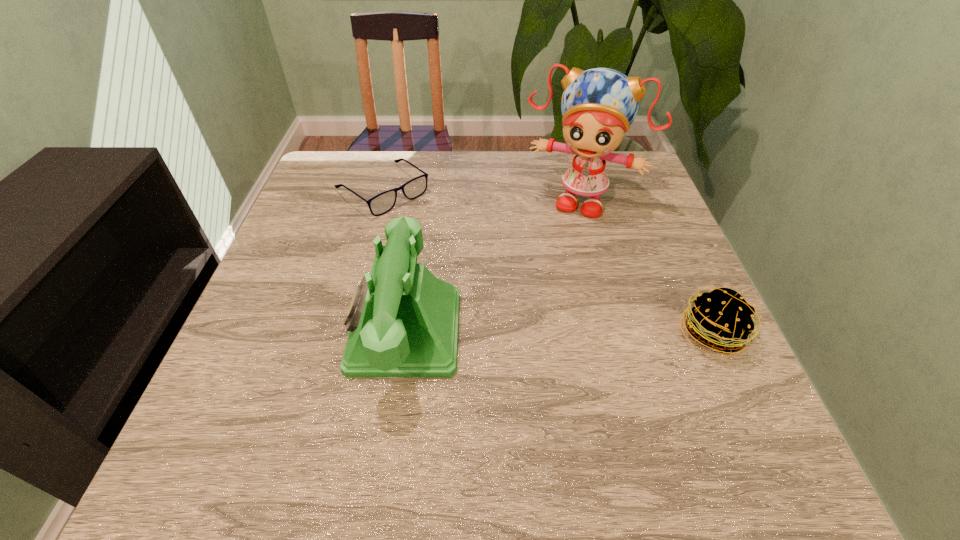
The width and height of the screenshot is (960, 540). I want to click on free space between the shortest object and the patty, so click(x=547, y=262).

Find the location of `vacant point located between the doll and the telephone`. vacant point located between the doll and the telephone is located at coordinates (492, 265).

At what (x,y) coordinates should I click in order to perform the action: click on vacant area between the second tallest object and the tallest object. Please return your answer as a coordinate pair (x, y). Looking at the image, I should click on (492, 265).

Find the location of a particular element. Image resolution: width=960 pixels, height=540 pixels. empty location between the second shortest object and the second tallest object is located at coordinates (558, 333).

You are a GUI agent. You are given a task and a screenshot of the screen. Output one action in this format:
    pyautogui.click(x=<x>, y=<y>)
    Task: Click on the free area in between the second tallest object and the doll
    The width and height of the screenshot is (960, 540).
    Given the screenshot: What is the action you would take?
    pyautogui.click(x=492, y=265)

Find the location of a particular element. This screenshot has width=960, height=540. the closest object to the doll is located at coordinates (403, 321).

Identify the location of object that stands as the third closest to the patty. (382, 203).

Locate an element on the screen. vacant area in the image that satisfies the following two spatial constraints: 1. on the front side of the shortest object; 2. on the dial of the second tallest object is located at coordinates (346, 331).

Locate an element on the screen. This screenshot has height=540, width=960. free spot that satisfies the following two spatial constraints: 1. on the front side of the third shortest object; 2. on the dial of the shortest object is located at coordinates (346, 331).

Locate an element on the screen. blank space that satisfies the following two spatial constraints: 1. on the front side of the shortest object; 2. on the right side of the doll is located at coordinates (380, 199).